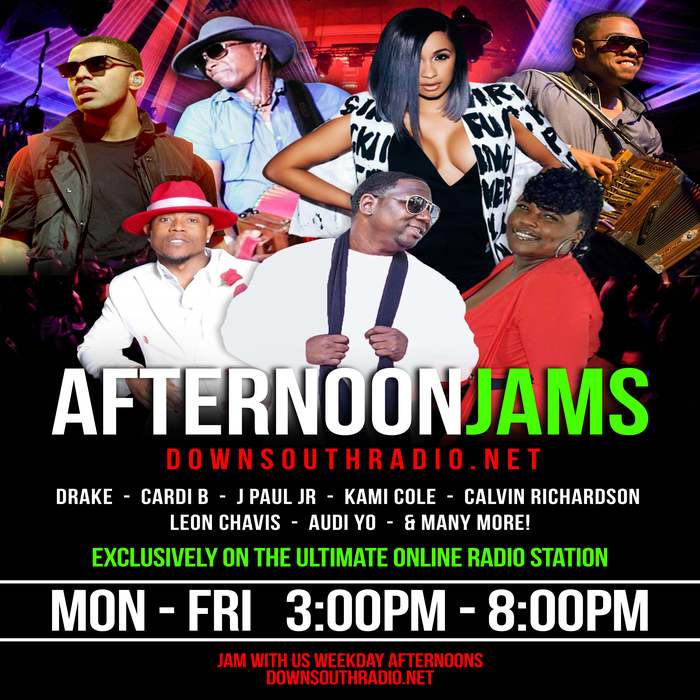
The height and width of the screenshot is (700, 700). I want to click on blue lights, so click(x=659, y=89), click(x=63, y=99).